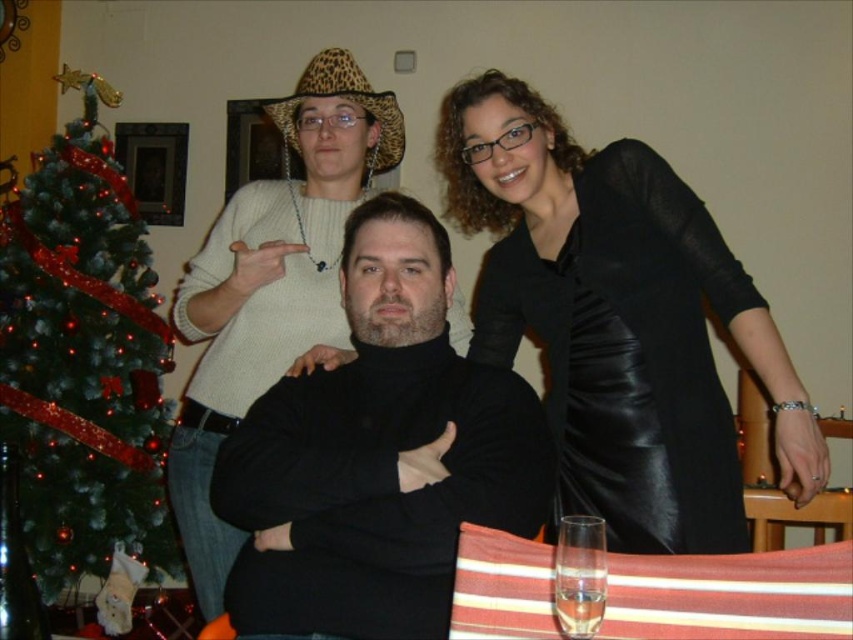
You are a photographer trying to capture a group photo of the scene. The camera is positioned at point A. You need to ensure that the black turtleneck sweater at center is centered in the photo. Based on its coordinates, where should you adjust the camera to achieve this?

The black turtleneck sweater at center is already positioned at the coordinates given, so adjusting the camera to center it would require aligning the camera to focus on point 0.713 on the x and 0.444 on the y axis.

Looking at this image, you are planning to take a photo of the black leather dress at upper right and the green textured christmas tree at left. Which object should you focus on first if you want to capture both in a single frame without moving the camera?

The black leather dress at upper right should be focused on first because it is smaller in size compared to the green textured christmas tree at left, allowing you to adjust the focus to include both in the frame.